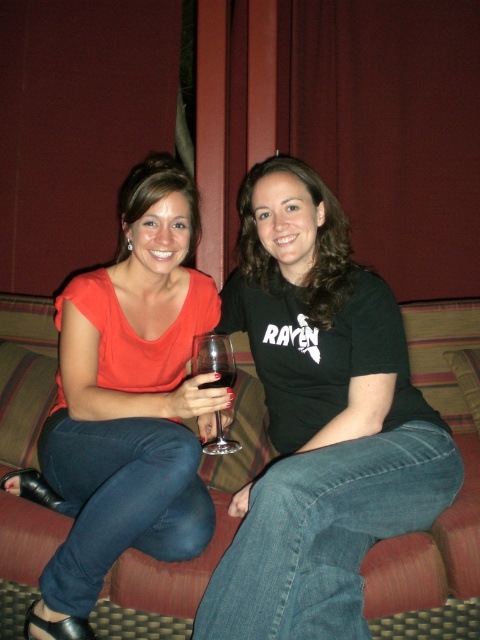
You are a photographer setting up a shoot in the scene described. You need to place a small prop between the black matte shirt at center and the clear glass wine glass at center. Based on their positions, where should you place the prop so it doesn

The black matte shirt at center is located above the clear glass wine glass at center, so you should place the prop between them by positioning it below the black matte shirt at center and above the clear glass wine glass at center.

You are a photographer setting up a shoot in this living room. You need to position a light source to the left of the black matte shirt at center and to the right of the textured fabric couch at center. Is this possible based on their current positions?

The black matte shirt at center is to the right of the textured fabric couch at center, so placing a light source to the left of the black matte shirt at center and to the right of the textured fabric couch at center is possible since there is space between them.